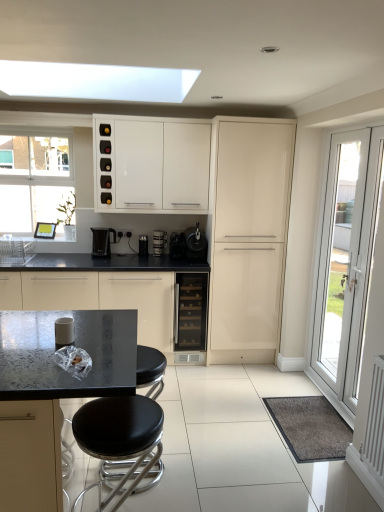
Question: Is there a large distance between satin black coffee machine at center, which ranks as the second coffee machine in left-to-right order, and satin black coffee machine at center, acting as the 1th coffee machine starting from the right?

Choices:
 (A) yes
 (B) no

Answer: (B)

Question: Considering the relative sizes of satin black coffee machine at center, which ranks as the second coffee machine in left-to-right order, and satin black coffee machine at center, the fourth coffee machine in the left-to-right sequence, in the image provided, is satin black coffee machine at center, which ranks as the second coffee machine in left-to-right order, smaller than satin black coffee machine at center, the fourth coffee machine in the left-to-right sequence,?

Choices:
 (A) yes
 (B) no

Answer: (A)

Question: Is satin black coffee machine at center, which ranks as the second coffee machine in left-to-right order, shorter than satin black coffee machine at center, the fourth coffee machine in the left-to-right sequence?

Choices:
 (A) yes
 (B) no

Answer: (A)

Question: Is satin black coffee machine at center, arranged as the 3th coffee machine when viewed from the right, oriented towards satin black coffee machine at center, acting as the 1th coffee machine starting from the right?

Choices:
 (A) yes
 (B) no

Answer: (B)

Question: Is satin black coffee machine at center, which ranks as the second coffee machine in left-to-right order, positioned behind satin black coffee machine at center, the fourth coffee machine in the left-to-right sequence?

Choices:
 (A) no
 (B) yes

Answer: (B)

Question: In the image, is matte black countertop at center, the first cabinetry in the left-to-right sequence, on the left side or the right side of black leather stool at lower center?

Choices:
 (A) right
 (B) left

Answer: (B)

Question: From the image's perspective, relative to black leather stool at lower center, is matte black countertop at center, the 3th cabinetry when ordered from right to left, above or below?

Choices:
 (A) above
 (B) below

Answer: (A)

Question: Is matte black countertop at center, the 3th cabinetry when ordered from right to left, in front of or behind black leather stool at lower center in the image?

Choices:
 (A) behind
 (B) front

Answer: (A)

Question: From a real-world perspective, is matte black countertop at center, the 3th cabinetry when ordered from right to left, positioned above or below black leather stool at lower center?

Choices:
 (A) above
 (B) below

Answer: (A)

Question: Is glossy cream cabinet at center, marked as the 3th cabinetry in a left-to-right arrangement, spatially inside metallic black coffee machine at center, or outside of it?

Choices:
 (A) inside
 (B) outside

Answer: (B)

Question: Does point (243, 256) appear closer or farther from the camera than point (139, 241)?

Choices:
 (A) closer
 (B) farther

Answer: (A)

Question: Relative to metallic black coffee machine at center, is glossy cream cabinet at center, marked as the 3th cabinetry in a left-to-right arrangement, in front or behind?

Choices:
 (A) front
 (B) behind

Answer: (A)

Question: Considering the positions of glossy cream cabinet at center, the first cabinetry in the right-to-left sequence, and metallic black coffee machine at center in the image, is glossy cream cabinet at center, the first cabinetry in the right-to-left sequence, taller or shorter than metallic black coffee machine at center?

Choices:
 (A) short
 (B) tall

Answer: (B)

Question: Considering the positions of metallic black coffee machine at center and white glossy door at right in the image, is metallic black coffee machine at center bigger or smaller than white glossy door at right?

Choices:
 (A) big
 (B) small

Answer: (B)

Question: Does point click(x=147, y=241) appear closer or farther from the camera than point click(x=354, y=244)?

Choices:
 (A) farther
 (B) closer

Answer: (A)